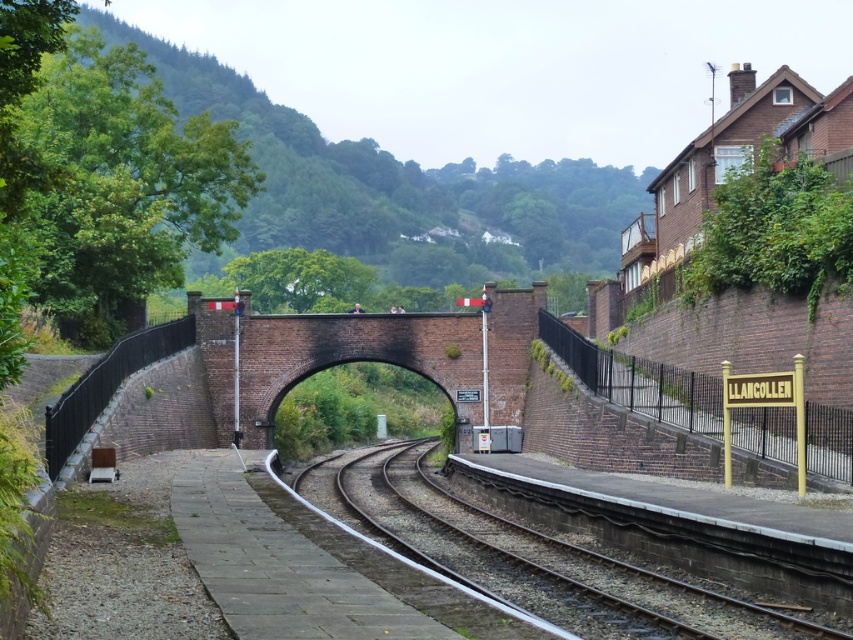
You are a photographer standing on the Llangollen station platform. You want to take a photo that includes both the brick archway at center and the smooth metal tracks at center. Which object should you position closer to the front of your photo to ensure both are in frame?

The brick archway at center is closer to the viewer than the smooth metal tracks at center, so you should position the brick archway at center closer to the front of your photo to ensure both are in frame.

You are standing at the Llangollen station platform and want to walk towards the bridge. Which direction should you head relative to the smooth metal tracks at center?

The smooth metal tracks at center curve gently to the left and disappear into the distance where they meet the bridge. To reach the bridge, you should follow the curve of the tracks towards the left.